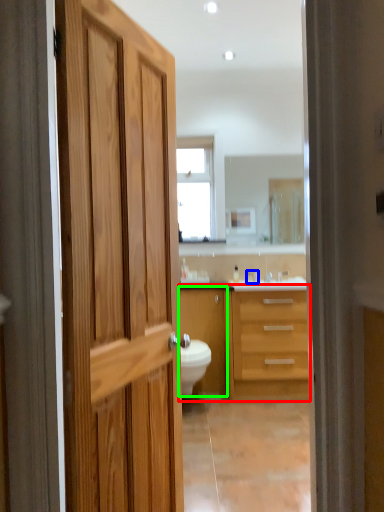
Question: Which object is the closest to the bathroom cabinet (highlighted by a red box)? Choose among these: faucet (highlighted by a blue box) or cabinetry (highlighted by a green box).

Choices:
 (A) faucet
 (B) cabinetry

Answer: (B)